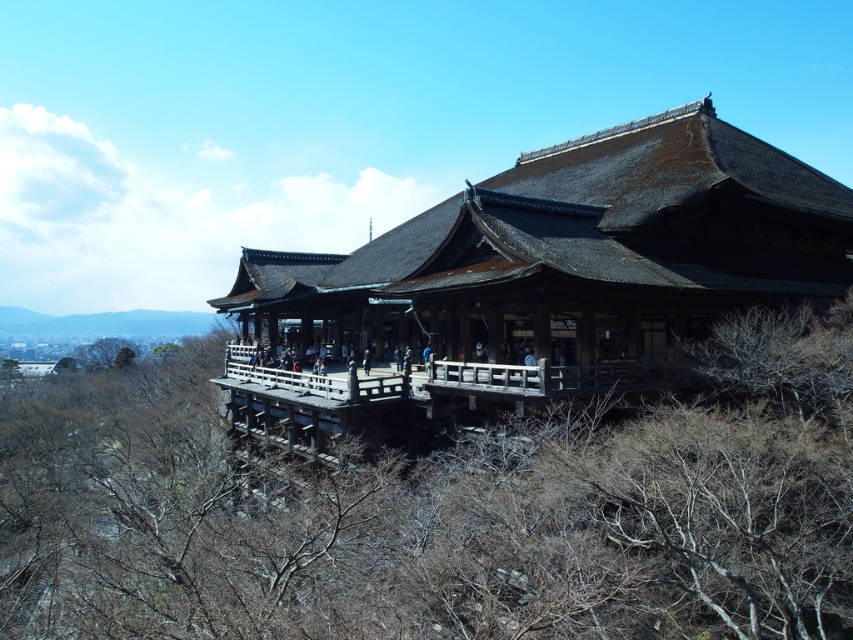
You are standing in front of the temple and notice an object in the scene. Where exactly is the brown leafless branches at lower center located in terms of coordinates?

The brown leafless branches at lower center are located at point coordinates of (x=440, y=509).

You are standing in front of the temple and want to take a photo. There are two points marked in the image, point 1 at coordinates point (x=376, y=536) and point 2 at coordinates point (x=720, y=241). Which point will appear closer to you in the photo?

Point (x=376, y=536) is closer to the camera than point (x=720, y=241), so it will appear closer in the photo.

You are standing at the entrance of the temple and see the point marked at coordinates [440,509]. What is located at that point?

The point marked at coordinates [440,509] indicates the location of brown leafless branches at lower center.